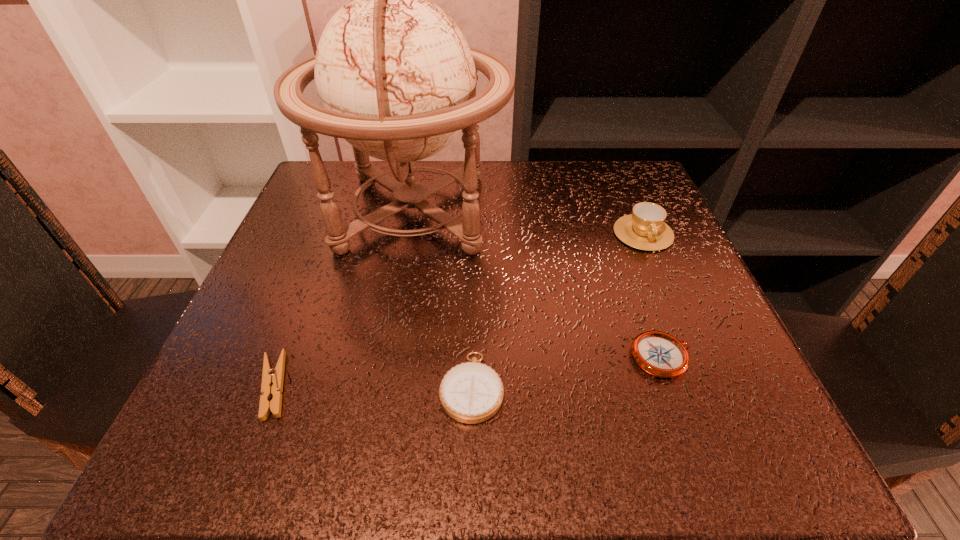
Identify the location of globe at the far edge. The width and height of the screenshot is (960, 540). (395, 76).

Image resolution: width=960 pixels, height=540 pixels. Identify the location of cup that is at the far edge. (645, 229).

You are a GUI agent. You are given a task and a screenshot of the screen. Output one action in this format:
    pyautogui.click(x=<x>, y=<y>)
    Task: Click on the compass that is at the near edge
    The height and width of the screenshot is (540, 960).
    Given the screenshot: What is the action you would take?
    pyautogui.click(x=472, y=392)

This screenshot has width=960, height=540. Identify the location of clothespin present at the near edge. (272, 379).

In order to click on globe located at the left edge in this screenshot , I will do click(x=395, y=76).

Where is `clothespin that is at the left edge`? Image resolution: width=960 pixels, height=540 pixels. clothespin that is at the left edge is located at coordinates (272, 379).

Find the location of a particular element. The width and height of the screenshot is (960, 540). cup located at the right edge is located at coordinates (645, 229).

You are a GUI agent. You are given a task and a screenshot of the screen. Output one action in this format:
    pyautogui.click(x=<x>, y=<y>)
    Task: Click on the compass that is at the right edge
    This screenshot has height=540, width=960.
    Given the screenshot: What is the action you would take?
    pyautogui.click(x=658, y=353)

What are the coordinates of `object that is at the far left corner` in the screenshot? It's located at (395, 76).

At what (x,y) coordinates should I click in order to perform the action: click on object situated at the near left corner. Please return your answer as a coordinate pair (x, y). The width and height of the screenshot is (960, 540). Looking at the image, I should click on (272, 379).